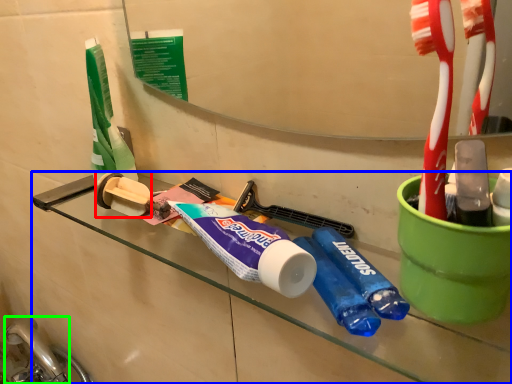
Question: Considering the real-world distances, which object is closest to toilet paper (highlighted by a red box)? counter (highlighted by a blue box) or faucet (highlighted by a green box).

Choices:
 (A) counter
 (B) faucet

Answer: (A)